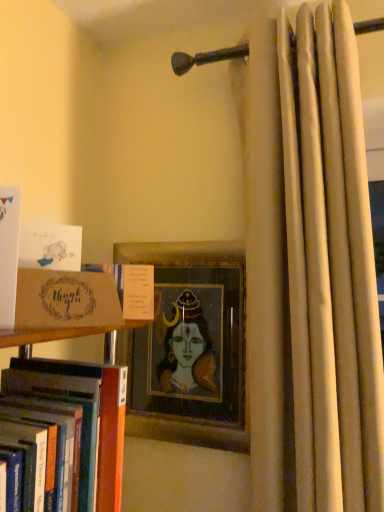
Where is `beige fabric curtain at right`? The height and width of the screenshot is (512, 384). beige fabric curtain at right is located at coordinates (311, 272).

Describe the element at coordinates (131, 288) in the screenshot. I see `brown cardboard box at left, the second book ordered from the bottom` at that location.

What do you see at coordinates (9, 253) in the screenshot? I see `white matte card at left, arranged as the 2th book when viewed from the top` at bounding box center [9, 253].

This screenshot has height=512, width=384. I want to click on white matte card at left, arranged as the 2th book when viewed from the top, so click(9, 253).

Find the location of `beige fabric curtain at right`. beige fabric curtain at right is located at coordinates (311, 272).

Where is `the 4th book counting from the left of the wooden picture frame at center`? This screenshot has width=384, height=512. the 4th book counting from the left of the wooden picture frame at center is located at coordinates (9, 253).

From a real-world perspective, who is located lower, white matte card at left, arranged as the 2th book when viewed from the top, or wooden picture frame at center?

From a 3D spatial view, wooden picture frame at center is below.

Is white matte card at left, which is the third book from bottom to top, inside the boundaries of wooden picture frame at center, or outside?

The correct answer is: outside.

Is white matte card at left, which is the third book from bottom to top, bigger or smaller than wooden picture frame at center?

In the image, white matte card at left, which is the third book from bottom to top, appears to be smaller than wooden picture frame at center.

From the beige fabric curtain at right, count the 1st book to the left and point to it. Please provide its 2D coordinates.

[(131, 288)]

From the picture: Considering the sizes of brown cardboard box at left, the second book ordered from the bottom, and beige fabric curtain at right in the image, is brown cardboard box at left, the second book ordered from the bottom, bigger or smaller than beige fabric curtain at right?

Considering their sizes, brown cardboard box at left, the second book ordered from the bottom, takes up less space than beige fabric curtain at right.

Which is correct: brown cardboard box at left, placed as the third book when sorted from top to bottom, is inside beige fabric curtain at right, or outside of it?

brown cardboard box at left, placed as the third book when sorted from top to bottom, is not inside beige fabric curtain at right, it's outside.

From the image's perspective, is brown cardboard box at left, placed as the third book when sorted from top to bottom, located beneath beige fabric curtain at right?

Correct, brown cardboard box at left, placed as the third book when sorted from top to bottom, appears lower than beige fabric curtain at right in the image.

Can you tell me how much white matte card at upper left, which ranks as the 1th book in top-to-bottom order, and brown cardboard box at left, placed as the third book when sorted from top to bottom, differ in facing direction?

white matte card at upper left, which ranks as the 1th book in top-to-bottom order, and brown cardboard box at left, placed as the third book when sorted from top to bottom, are facing 19.5 degrees away from each other.

Is white matte card at upper left, which ranks as the 1th book in top-to-bottom order, in contact with brown cardboard box at left, placed as the third book when sorted from top to bottom?

Yes, white matte card at upper left, which ranks as the 1th book in top-to-bottom order, is beside brown cardboard box at left, placed as the third book when sorted from top to bottom.

Is white matte card at upper left, marked as the fourth book in a bottom-to-top arrangement, thinner than brown cardboard box at left, the second book ordered from the bottom?

Correct, the width of white matte card at upper left, marked as the fourth book in a bottom-to-top arrangement, is less than that of brown cardboard box at left, the second book ordered from the bottom.

From a real-world perspective, which object rests below the other?

In real-world perspective, hardcover book at center, marked as the 1th book in a bottom-to-top arrangement, is lower.

Which object is thinner, wooden picture frame at center or hardcover book at center, arranged as the 4th book when viewed from the top?

With smaller width is wooden picture frame at center.

Is wooden picture frame at center bigger than hardcover book at center, marked as the 1th book in a bottom-to-top arrangement?

No, wooden picture frame at center is not bigger than hardcover book at center, marked as the 1th book in a bottom-to-top arrangement.

From the image's perspective, is wooden picture frame at center above or below hardcover book at center, arranged as the 4th book when viewed from the top?

wooden picture frame at center is situated higher than hardcover book at center, arranged as the 4th book when viewed from the top, in the image.

Is hardcover book at center, arranged as the 4th book when viewed from the top, placed right next to white matte card at upper left, marked as the fourth book in a bottom-to-top arrangement?

No, hardcover book at center, arranged as the 4th book when viewed from the top, is not making contact with white matte card at upper left, marked as the fourth book in a bottom-to-top arrangement.

In the scene shown: Between hardcover book at center, marked as the 1th book in a bottom-to-top arrangement, and white matte card at upper left, marked as the fourth book in a bottom-to-top arrangement, which one has smaller width?

white matte card at upper left, marked as the fourth book in a bottom-to-top arrangement.

Considering the sizes of objects hardcover book at center, arranged as the 4th book when viewed from the top, and white matte card at upper left, marked as the fourth book in a bottom-to-top arrangement, in the image provided, who is bigger, hardcover book at center, arranged as the 4th book when viewed from the top, or white matte card at upper left, marked as the fourth book in a bottom-to-top arrangement,?

hardcover book at center, arranged as the 4th book when viewed from the top.

Does hardcover book at center, arranged as the 4th book when viewed from the top, appear on the left side of white matte card at upper left, which ranks as the 1th book in top-to-bottom order?

Yes, hardcover book at center, arranged as the 4th book when viewed from the top, is to the left of white matte card at upper left, which ranks as the 1th book in top-to-bottom order.

Who is more distant, wooden picture frame at center or beige fabric curtain at right?

wooden picture frame at center is further from the camera.

Is wooden picture frame at center directly adjacent to beige fabric curtain at right?

No.

Considering the relative sizes of wooden picture frame at center and beige fabric curtain at right in the image provided, is wooden picture frame at center bigger than beige fabric curtain at right?

Actually, wooden picture frame at center might be smaller than beige fabric curtain at right.

From the image's perspective, which one is positioned higher, wooden picture frame at center or beige fabric curtain at right?

From the image's view, beige fabric curtain at right is above.

Is white matte card at left, which is the third book from bottom to top, not near brown cardboard box at left, placed as the third book when sorted from top to bottom?

They are positioned close to each other.

Looking at their sizes, would you say white matte card at left, which is the third book from bottom to top, is wider or thinner than brown cardboard box at left, placed as the third book when sorted from top to bottom?

Considering their sizes, white matte card at left, which is the third book from bottom to top, looks slimmer than brown cardboard box at left, placed as the third book when sorted from top to bottom.

Which object is positioned more to the left, white matte card at left, which is the third book from bottom to top, or brown cardboard box at left, the second book ordered from the bottom?

white matte card at left, which is the third book from bottom to top.

From a real-world perspective, does white matte card at left, which is the third book from bottom to top, sit lower than brown cardboard box at left, the second book ordered from the bottom?

No.

From the image's perspective, count 2nd books upward from the wooden picture frame at center and point to it. Please provide its 2D coordinates.

[(9, 253)]

From a real-world perspective, count 2nd books downward from the beige fabric curtain at right and point to it. Please provide its 2D coordinates.

[(131, 288)]

Estimate the real-world distances between objects in this image. Which object is further from brown cardboard box at left, placed as the third book when sorted from top to bottom, beige fabric curtain at right or white matte card at upper left, marked as the fourth book in a bottom-to-top arrangement?

beige fabric curtain at right is positioned further to the anchor brown cardboard box at left, placed as the third book when sorted from top to bottom.

Considering their positions, is white matte card at upper left, which ranks as the 1th book in top-to-bottom order, positioned further to hardcover book at center, marked as the 1th book in a bottom-to-top arrangement, than matte brown card at left?

white matte card at upper left, which ranks as the 1th book in top-to-bottom order, is further to hardcover book at center, marked as the 1th book in a bottom-to-top arrangement.

Considering their positions, is white matte card at upper left, marked as the fourth book in a bottom-to-top arrangement, positioned further to brown cardboard box at left, placed as the third book when sorted from top to bottom, than white matte card at left, which is the third book from bottom to top?

The object further to brown cardboard box at left, placed as the third book when sorted from top to bottom, is white matte card at left, which is the third book from bottom to top.

Considering their positions, is wooden picture frame at center positioned closer to beige fabric curtain at right than white matte card at upper left, which ranks as the 1th book in top-to-bottom order?

Based on the image, wooden picture frame at center appears to be nearer to beige fabric curtain at right.

When comparing their distances from brown cardboard box at left, the second book ordered from the bottom, does white matte card at left, which is the third book from bottom to top, or matte brown card at left seem further?

Based on the image, white matte card at left, which is the third book from bottom to top, appears to be further to brown cardboard box at left, the second book ordered from the bottom.

From the picture: When comparing their distances from brown cardboard box at left, placed as the third book when sorted from top to bottom, does beige fabric curtain at right or white matte card at left, arranged as the 2th book when viewed from the top, seem further?

beige fabric curtain at right.

Based on their spatial positions, is wooden picture frame at center or white matte card at upper left, marked as the fourth book in a bottom-to-top arrangement, closer to matte brown card at left?

The object closer to matte brown card at left is white matte card at upper left, marked as the fourth book in a bottom-to-top arrangement.

Estimate the real-world distances between objects in this image. Which object is closer to wooden picture frame at center, brown cardboard box at left, the second book ordered from the bottom, or white matte card at left, arranged as the 2th book when viewed from the top?

brown cardboard box at left, the second book ordered from the bottom, is closer to wooden picture frame at center.

The width and height of the screenshot is (384, 512). Identify the location of book cover that lies between white matte card at left, arranged as the 2th book when viewed from the top, and hardcover book at center, arranged as the 4th book when viewed from the top, from top to bottom. (66, 300).

This screenshot has height=512, width=384. What are the coordinates of `book between matte brown card at left and hardcover book at center, marked as the 1th book in a bottom-to-top arrangement, in the up-down direction` in the screenshot? It's located at (131, 288).

What are the coordinates of `curtain positioned between matte brown card at left and wooden picture frame at center from near to far` in the screenshot? It's located at (311, 272).

Locate an element on the screen. The width and height of the screenshot is (384, 512). book between white matte card at upper left, marked as the fourth book in a bottom-to-top arrangement, and wooden picture frame at center in the front-back direction is located at coordinates (131, 288).